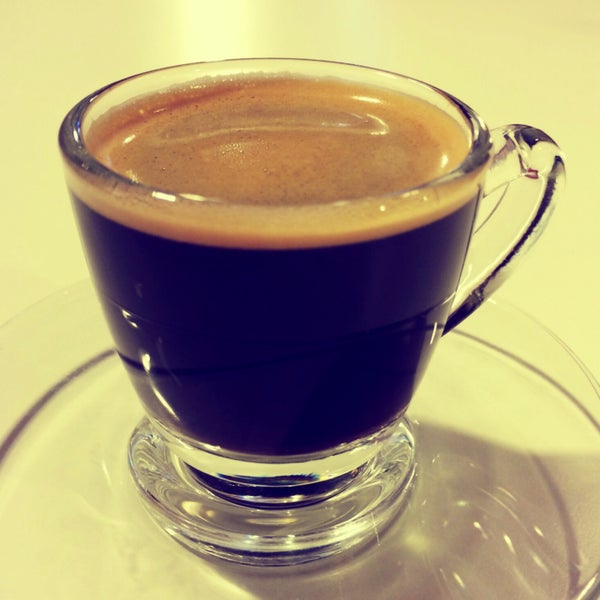
Identify the location of foam. (264, 225).